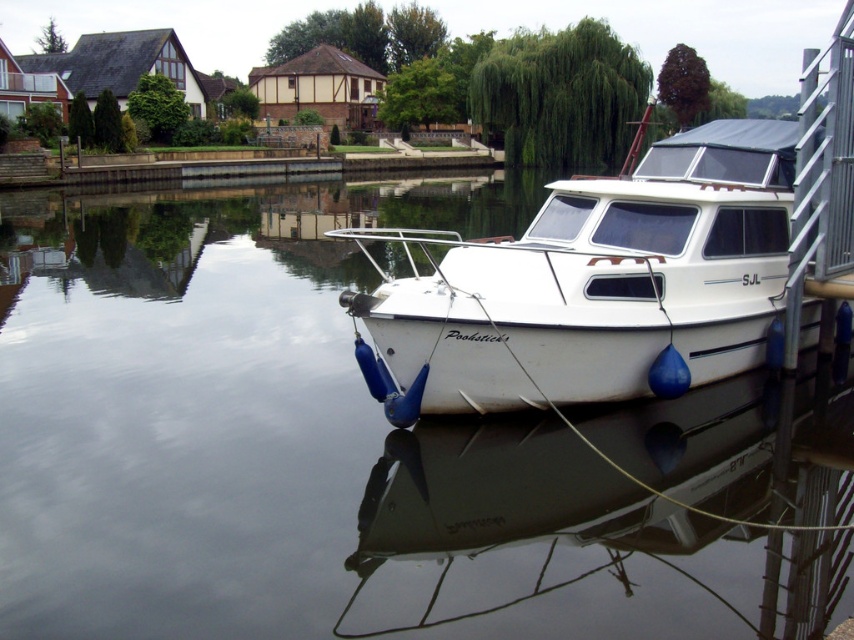
You are planning to launch a small kayak from the dock. The kayak requires a clear path wider than the kayak itself to avoid hitting the white matte boat at right. Can you determine if the smooth water at boat right provides enough space for the kayak to pass safely?

The smooth water at boat right might be wider than the white matte boat at right, so there is a possibility that the kayak can pass safely if the width of the water area is sufficient. However, the exact dimensions are not provided, so it is recommended to measure the space before launching.

You are standing on the dock and want to check the depth of the water near the boat. The smooth water at boat right is crucial for anchoring. Can you safely anchor here if your anchor requires at least 3 meters of water depth?

The smooth water at boat right is 5.16 meters away from the viewer, but this distance refers to the horizontal separation between the viewer and the water area, not the depth of the water. Therefore, this information alone cannot confirm whether the water is deep enough for anchoring. Additional depth measurements would be needed.